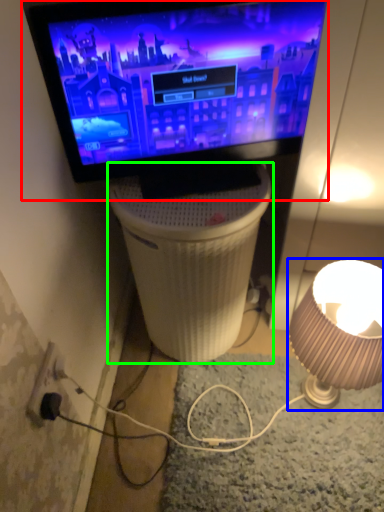
Question: Based on their relative distances, which object is nearer to television (highlighted by a red box)? Choose from lamp (highlighted by a blue box) and table (highlighted by a green box).

Choices:
 (A) lamp
 (B) table

Answer: (B)